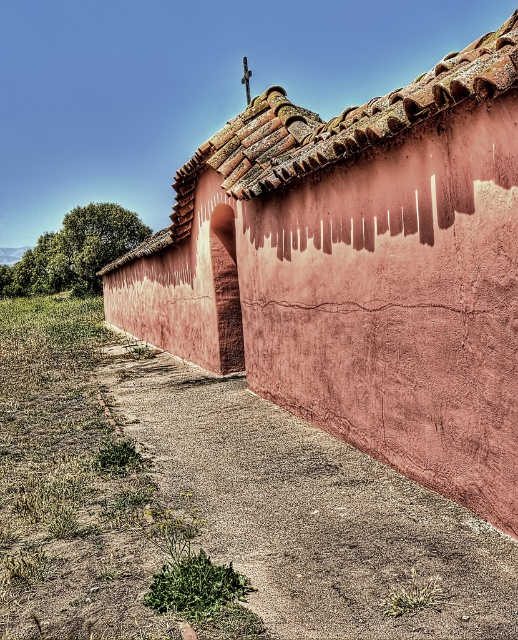
Question: Is matte clay hut at center further to the viewer compared to brown clay tiles at upper center?

Choices:
 (A) yes
 (B) no

Answer: (B)

Question: Which object appears farthest from the camera in this image?

Choices:
 (A) matte clay hut at center
 (B) brown clay tiles at upper center

Answer: (B)

Question: Does matte clay hut at center appear on the left side of brown clay tiles at upper center?

Choices:
 (A) yes
 (B) no

Answer: (A)

Question: Which point is closer to the camera taking this photo?

Choices:
 (A) (303, 156)
 (B) (491, 433)

Answer: (B)

Question: Considering the relative positions of matte clay hut at center and brown clay tiles at upper center in the image provided, where is matte clay hut at center located with respect to brown clay tiles at upper center?

Choices:
 (A) right
 (B) left

Answer: (B)